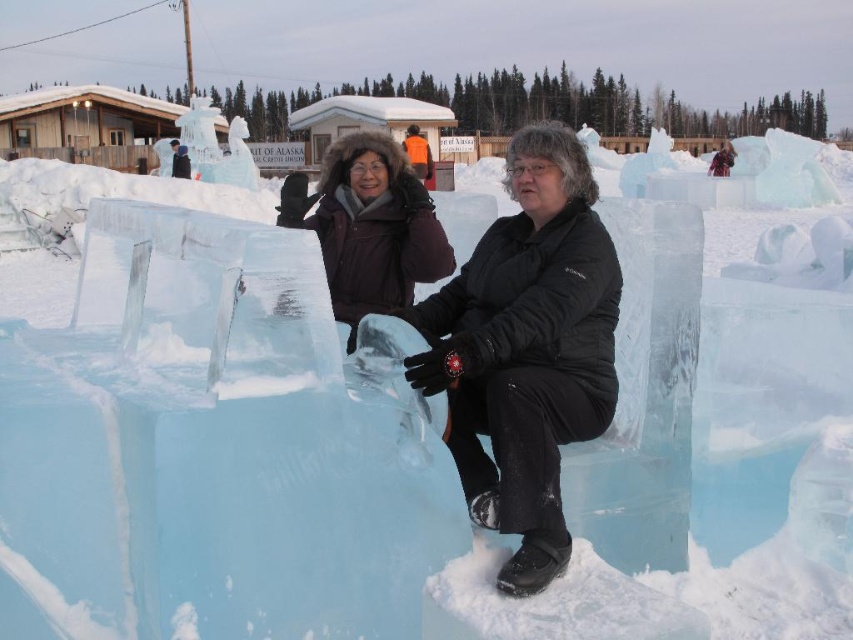
You are a photographer trying to capture both the transparent ice sculpture at center and the matte black jacket at center in a single frame. Since the ice sculpture is larger, where should you position your camera to ensure both are fully visible?

The transparent ice sculpture at center is larger in size than the matte black jacket at center, so you should position your camera farther away to ensure both are fully visible in the frame.

You are standing in the winter ice festival and see the transparent ice sculpture at center and the matte black jacket at center. Which object is positioned to the right of the other?

The transparent ice sculpture at center is to the right of the matte black jacket at center.